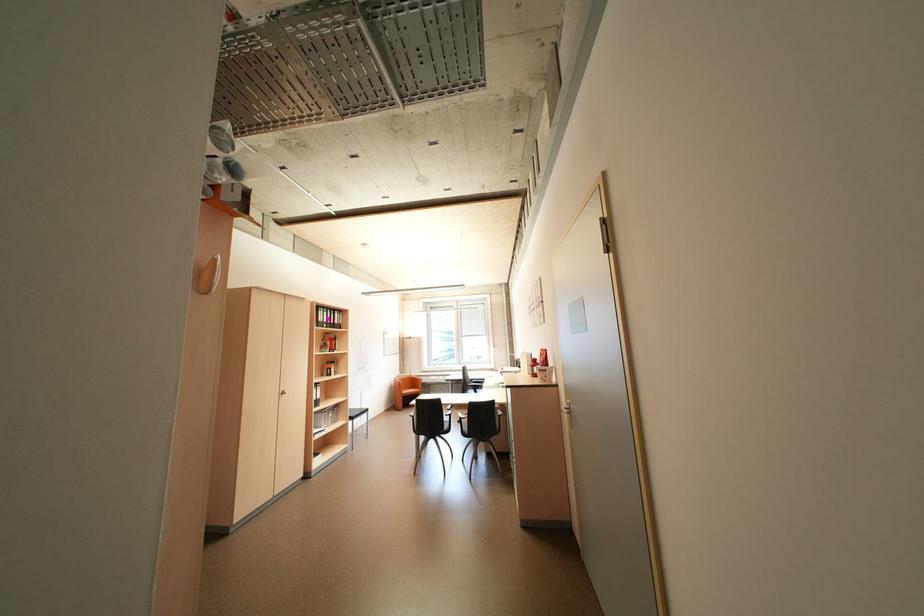
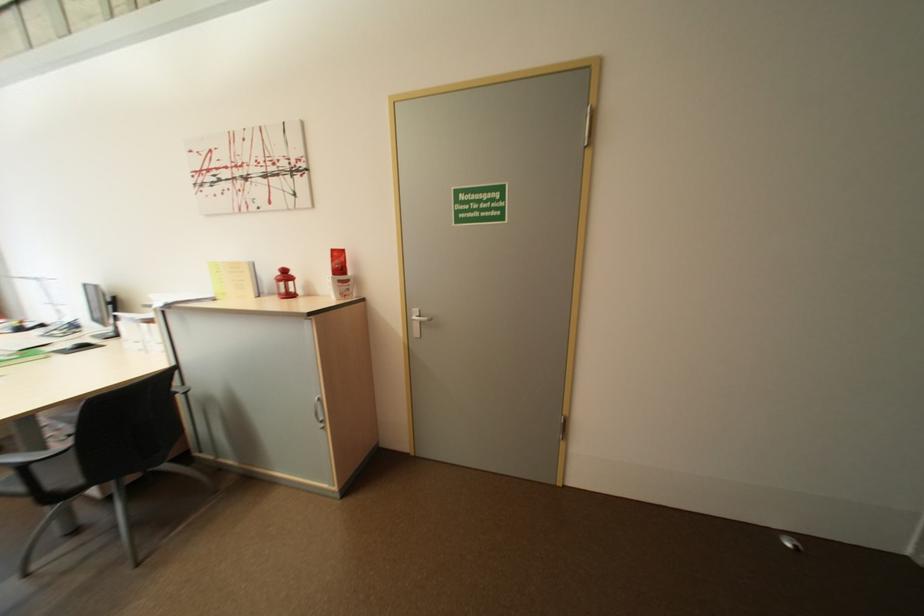
Find the pixel in the second image that matches point (475, 429) in the first image.

(75, 477)